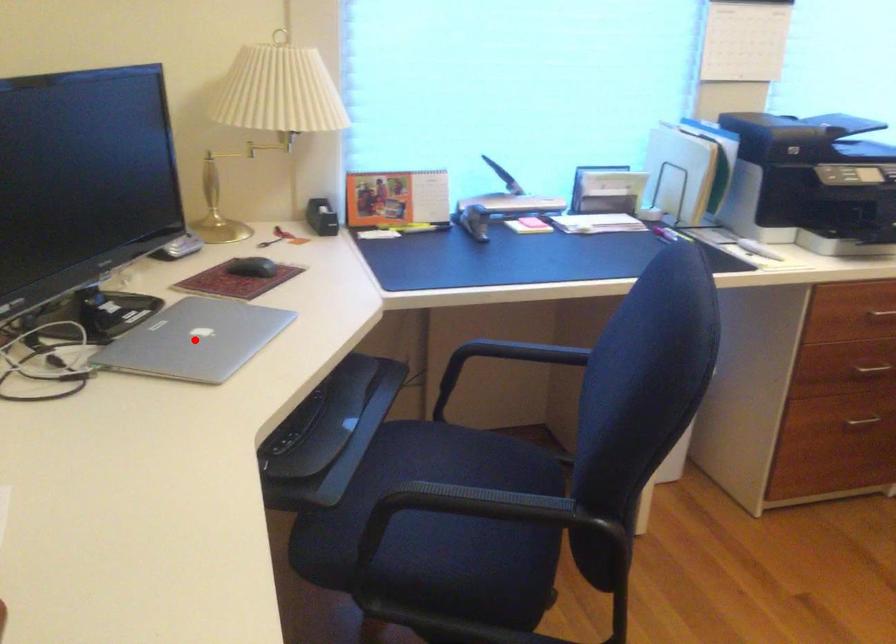
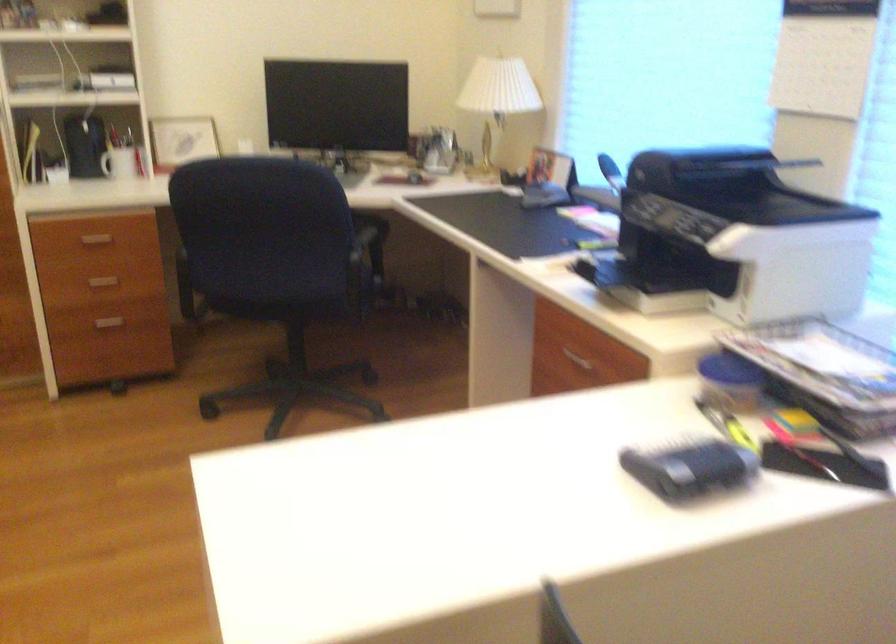
Question: I am providing you with two images of the same scene from different viewpoints. A red point is marked on the first image. Can you still see the location of the red point in image 2?

Choices:
 (A) Yes
 (B) No

Answer: (B)